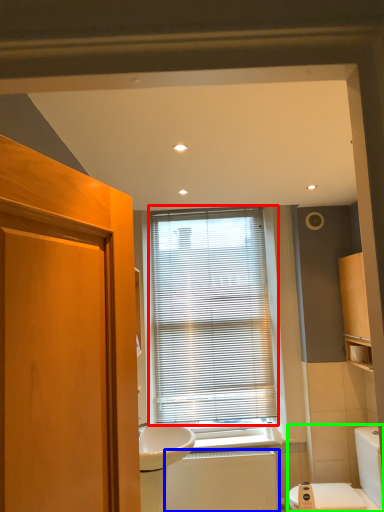
Question: Which object is positioned closest to window blind (highlighted by a red box)? Select from radiator (highlighted by a blue box) and toilet (highlighted by a green box).

Choices:
 (A) radiator
 (B) toilet

Answer: (A)